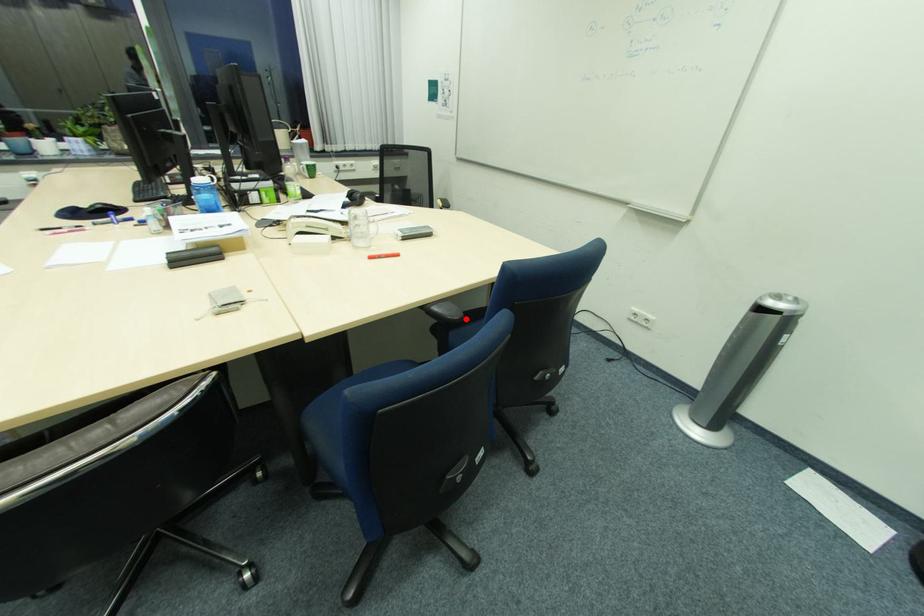
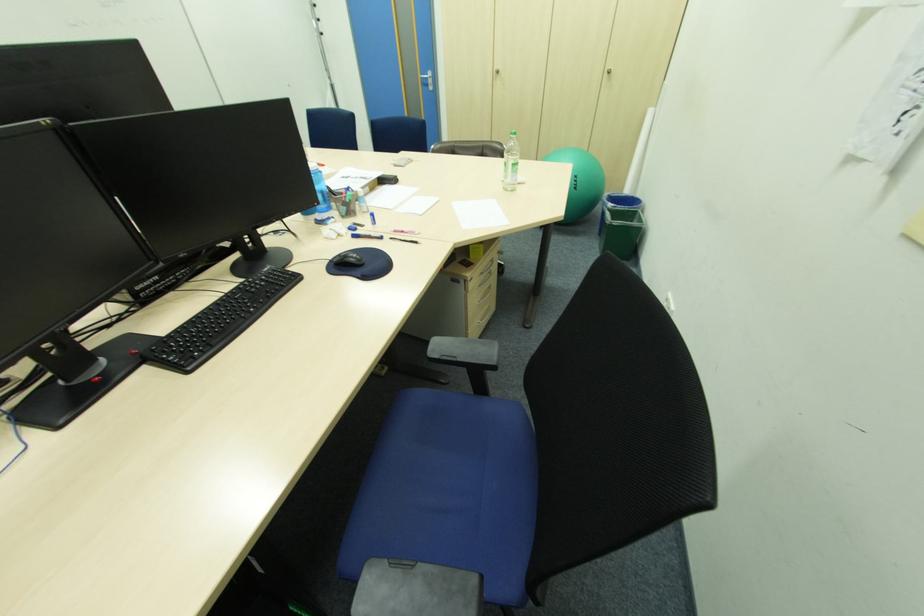
Question: I am providing you with two images of the same scene from different viewpoints. A red point is marked on the first image. Can you still see the location of the red point in image 2?

Choices:
 (A) Yes
 (B) No

Answer: (B)